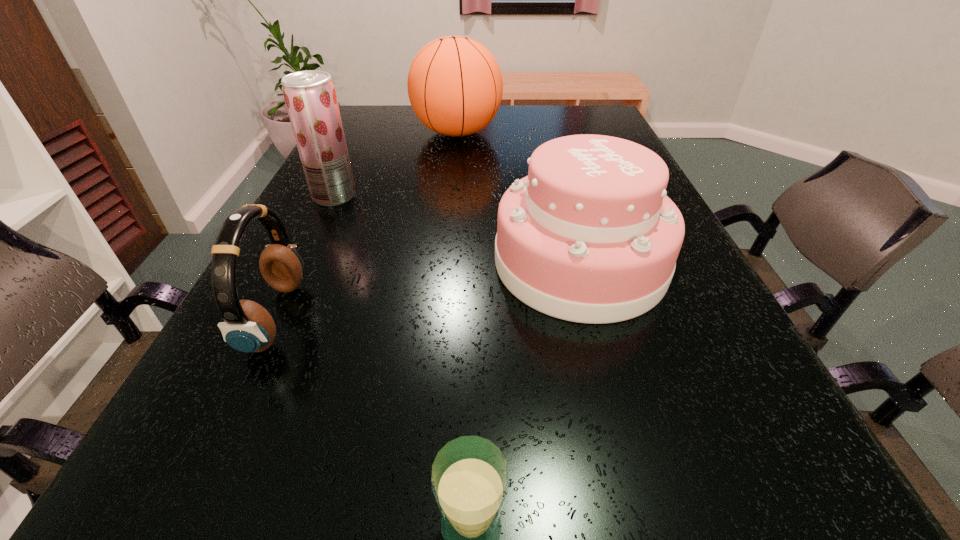
The image size is (960, 540). Identify the location of headset situated at the left edge. (248, 327).

Identify the location of object present at the right edge. (589, 236).

In the image, there is a desktop. Find the location of `vacant area at the far edge`. vacant area at the far edge is located at coordinates (541, 111).

The height and width of the screenshot is (540, 960). What are the coordinates of `vacant space at the left edge of the desktop` in the screenshot? It's located at (341, 261).

The width and height of the screenshot is (960, 540). I want to click on vacant space at the right edge, so click(x=751, y=393).

Find the location of a particular element. vacant space at the far right corner of the desktop is located at coordinates (593, 117).

This screenshot has height=540, width=960. In order to click on empty location between the headset and the birthday cake in this screenshot , I will do `click(428, 289)`.

At what (x,y) coordinates should I click in order to perform the action: click on free space between the birthday cake and the headset. Please return your answer as a coordinate pair (x, y). Looking at the image, I should click on (428, 289).

Where is `vacant point located between the headset and the fruit juice`? This screenshot has width=960, height=540. vacant point located between the headset and the fruit juice is located at coordinates (305, 256).

Where is `free spot between the farthest object and the fruit juice`? free spot between the farthest object and the fruit juice is located at coordinates (396, 164).